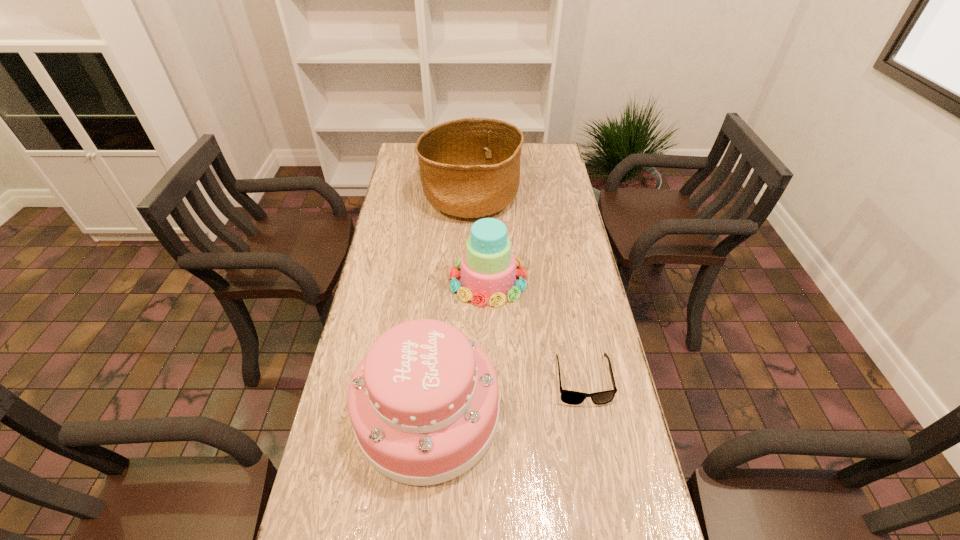
What are the coordinates of `the farthest object` in the screenshot? It's located at (469, 168).

At what (x,y) coordinates should I click in order to perform the action: click on the nearer cake. Please return your answer as a coordinate pair (x, y). Looking at the image, I should click on (424, 402).

The image size is (960, 540). What are the coordinates of `the second farthest object` in the screenshot? It's located at (488, 266).

Where is `the rightmost object`? The width and height of the screenshot is (960, 540). the rightmost object is located at coordinates (569, 397).

Locate an element on the screen. This screenshot has width=960, height=540. the shortest object is located at coordinates (569, 397).

At what (x,y) coordinates should I click in order to perform the action: click on blank space located 0.160m on the right of the farthest object. Please return your answer as a coordinate pair (x, y). Looking at the image, I should click on (x=560, y=197).

At what (x,y) coordinates should I click in order to perform the action: click on vacant space positioned on the right of the nearer cake. Please return your answer as a coordinate pair (x, y). The image size is (960, 540). Looking at the image, I should click on (566, 413).

At what (x,y) coordinates should I click in order to perform the action: click on vacant space situated on the front of the farther cake. Please return your answer as a coordinate pair (x, y). Looking at the image, I should click on (490, 357).

Where is `vacant space located on the front-facing side of the sunglasses`? Image resolution: width=960 pixels, height=540 pixels. vacant space located on the front-facing side of the sunglasses is located at coordinates (595, 449).

Identify the location of object that is at the far edge. (469, 168).